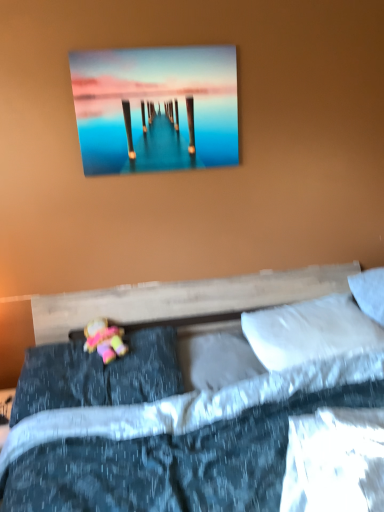
The height and width of the screenshot is (512, 384). Find the location of `blank space above white soft pillow at center, marked as the 3th pillow in a right-to-left arrangement (from a real-world perspective)`. blank space above white soft pillow at center, marked as the 3th pillow in a right-to-left arrangement (from a real-world perspective) is located at coordinates coord(223,336).